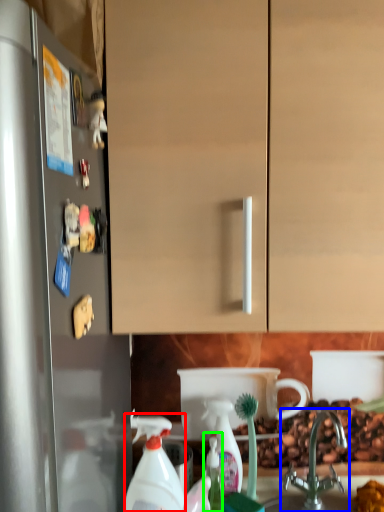
Question: Based on their relative distances, which object is nearer to cleaning product (highlighted by a red box)? Choose from tap (highlighted by a blue box) and bottle (highlighted by a green box).

Choices:
 (A) tap
 (B) bottle

Answer: (B)